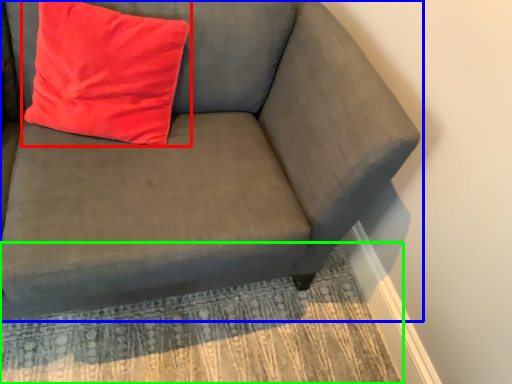
Question: Based on their relative distances, which object is farther from pillow (highlighted by a red box)? Choose from studio couch (highlighted by a blue box) and mat (highlighted by a green box).

Choices:
 (A) studio couch
 (B) mat

Answer: (B)